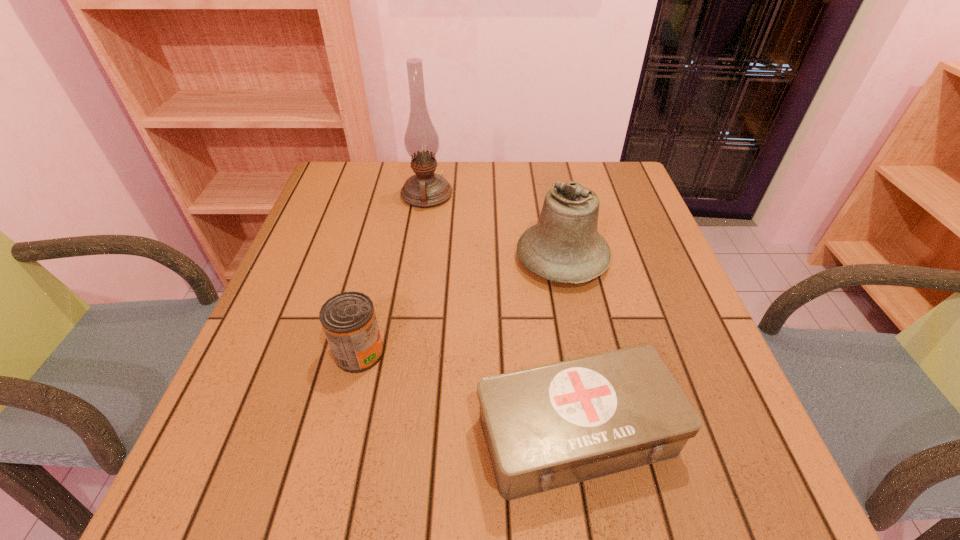
Identify the location of free space between the nearest object and the bell. (569, 346).

Where is `vacant space that's between the shortest object and the third shortest object`? The height and width of the screenshot is (540, 960). vacant space that's between the shortest object and the third shortest object is located at coordinates (569, 346).

Image resolution: width=960 pixels, height=540 pixels. I want to click on free area in between the second farthest object and the farthest object, so click(494, 227).

The image size is (960, 540). In order to click on object that is the third closest to the bell in this screenshot , I will do `click(348, 319)`.

You are a GUI agent. You are given a task and a screenshot of the screen. Output one action in this format:
    pyautogui.click(x=<x>, y=<y>)
    Task: Click on the closest object to the bell
    The width and height of the screenshot is (960, 540).
    Given the screenshot: What is the action you would take?
    pyautogui.click(x=426, y=189)

The image size is (960, 540). Identify the location of blank space that satisfies the following two spatial constraints: 1. on the front side of the second farthest object; 2. on the left side of the oil lamp. (417, 259).

You are a GUI agent. You are given a task and a screenshot of the screen. Output one action in this format:
    pyautogui.click(x=<x>, y=<y>)
    Task: Click on the free location that satisfies the following two spatial constraints: 1. on the back side of the can; 2. on the right side of the second farthest object
    The width and height of the screenshot is (960, 540).
    Given the screenshot: What is the action you would take?
    382,259